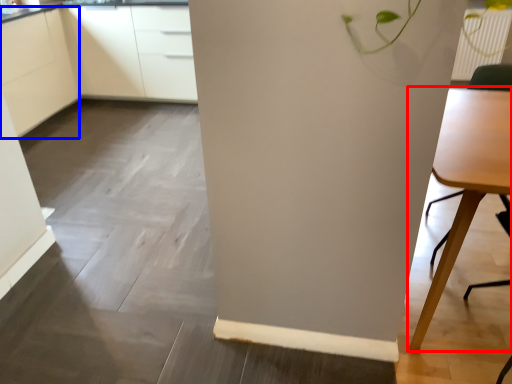
Question: Which object is further to the camera taking this photo, table (highlighted by a red box) or cabinetry (highlighted by a blue box)?

Choices:
 (A) table
 (B) cabinetry

Answer: (B)